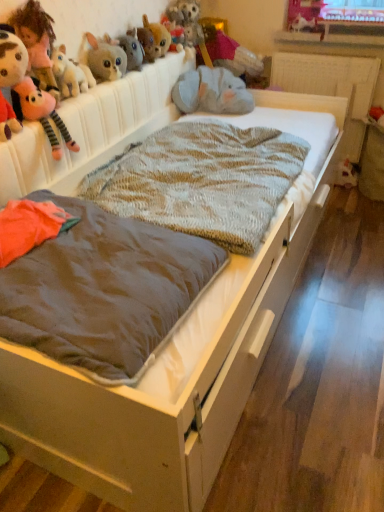
Where is `free point in front of white plush toy at lower right, which appears as the 1th toy when viewed from the right`? free point in front of white plush toy at lower right, which appears as the 1th toy when viewed from the right is located at coordinates (340, 196).